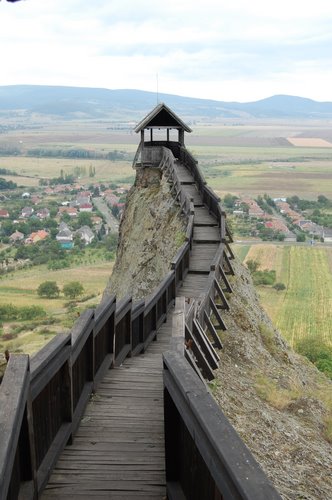
Find the location of a particular element. Image resolution: width=332 pixels, height=500 pixels. stairs is located at coordinates (160, 351), (144, 424), (202, 264), (192, 195).